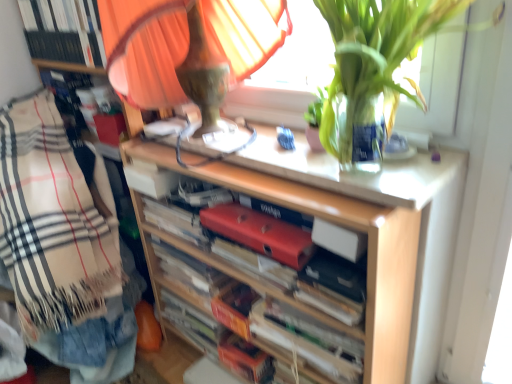
Question: From a real-world perspective, is white paper book at center, which is counted as the 4th book, starting from the top, over hardcover book at center, which is the first paperback book in bottom-to-top order?

Choices:
 (A) yes
 (B) no

Answer: (B)

Question: Is white paper book at center, the second book positioned from the bottom, to the right of hardcover book at center, which is the first paperback book in bottom-to-top order, from the viewer's perspective?

Choices:
 (A) no
 (B) yes

Answer: (A)

Question: Is white paper book at center, which is counted as the 4th book, starting from the top, aimed at hardcover book at center, which is the first paperback book in bottom-to-top order?

Choices:
 (A) no
 (B) yes

Answer: (A)

Question: Is white paper book at center, the second book positioned from the bottom, to the left of hardcover book at center, which is the first paperback book in bottom-to-top order, from the viewer's perspective?

Choices:
 (A) no
 (B) yes

Answer: (B)

Question: Are white paper book at center, which is counted as the 4th book, starting from the top, and hardcover book at center, which is counted as the 3th paperback book, starting from the top, located far from each other?

Choices:
 (A) yes
 (B) no

Answer: (B)

Question: From a real-world perspective, is beige plaid blanket at left above or below wooden shelf at center?

Choices:
 (A) below
 (B) above

Answer: (B)

Question: Choose the correct answer: Is beige plaid blanket at left inside wooden shelf at center or outside it?

Choices:
 (A) inside
 (B) outside

Answer: (B)

Question: Is beige plaid blanket at left bigger or smaller than wooden shelf at center?

Choices:
 (A) small
 (B) big

Answer: (B)

Question: Is beige plaid blanket at left to the left or to the right of wooden shelf at center in the image?

Choices:
 (A) right
 (B) left

Answer: (B)

Question: From their relative heights in the image, would you say hardcover book at center, which is the first paperback book in bottom-to-top order, is taller or shorter than white paper book at center, which is counted as the 4th book, starting from the top?

Choices:
 (A) short
 (B) tall

Answer: (A)

Question: From the image's perspective, is hardcover book at center, which is counted as the 3th paperback book, starting from the top, above or below white paper book at center, the second book positioned from the bottom?

Choices:
 (A) below
 (B) above

Answer: (B)

Question: Relative to white paper book at center, which is counted as the 4th book, starting from the top, is hardcover book at center, which is counted as the 3th paperback book, starting from the top, in front or behind?

Choices:
 (A) behind
 (B) front

Answer: (B)

Question: Is hardcover book at center, which is counted as the 3th paperback book, starting from the top, spatially inside white paper book at center, the second book positioned from the bottom, or outside of it?

Choices:
 (A) inside
 (B) outside

Answer: (B)

Question: Looking at their shapes, would you say beige plaid blanket at left is wider or thinner than hardcover book at center, which is the first paperback book in bottom-to-top order?

Choices:
 (A) thin
 (B) wide

Answer: (B)

Question: From a real-world perspective, is beige plaid blanket at left positioned above or below hardcover book at center, which is counted as the 3th paperback book, starting from the top?

Choices:
 (A) above
 (B) below

Answer: (B)